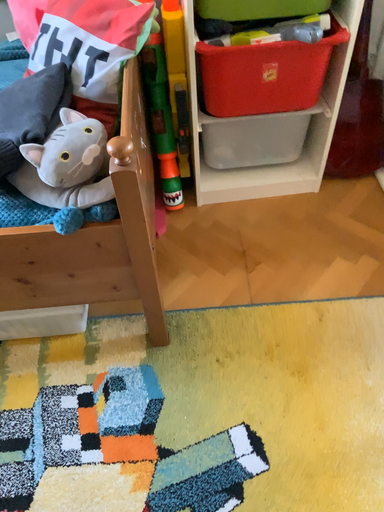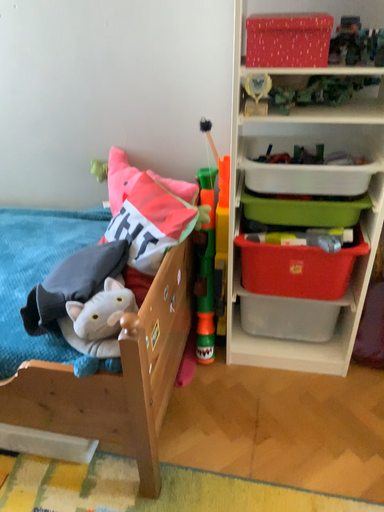
Question: Which way did the camera rotate in the video?

Choices:
 (A) rotated downward
 (B) rotated upward

Answer: (B)